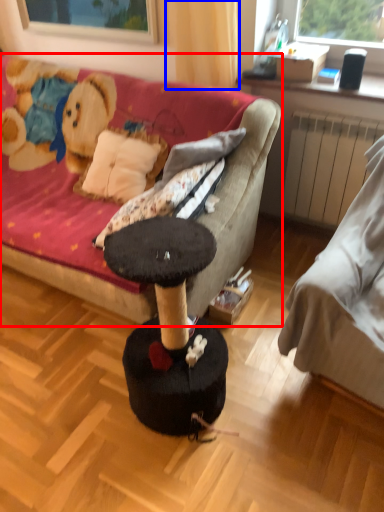
Question: Which object is further to the camera taking this photo, studio couch (highlighted by a red box) or curtain (highlighted by a blue box)?

Choices:
 (A) studio couch
 (B) curtain

Answer: (B)